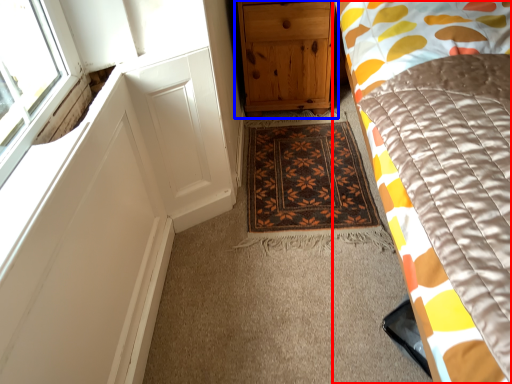
Question: Which of the following is the closest to the observer, bed (highlighted by a red box) or chest of drawers (highlighted by a blue box)?

Choices:
 (A) bed
 (B) chest of drawers

Answer: (A)